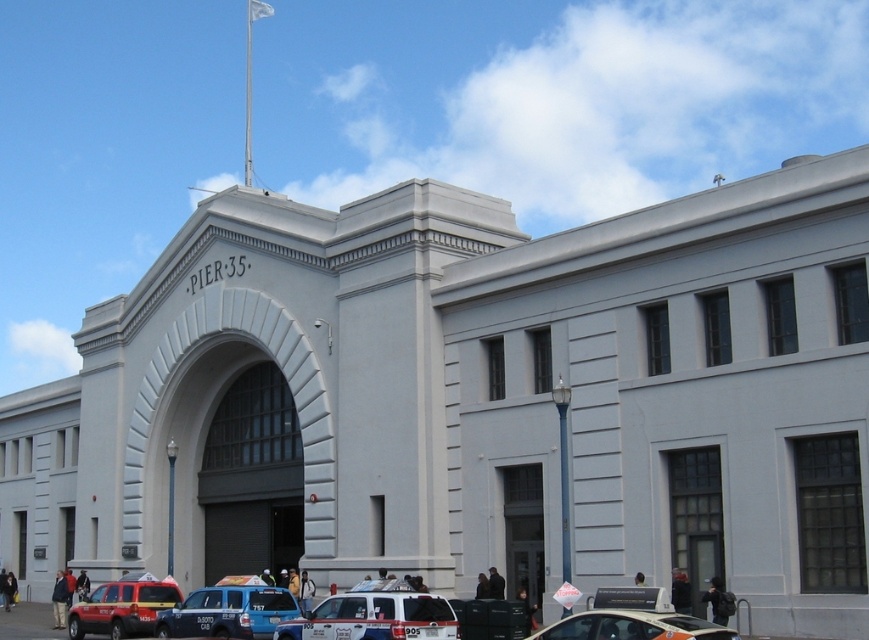
Is white glossy car at lower right bigger than matte red suv at lower left?

No.

Is point (647, 593) farther from camera compared to point (123, 636)?

That is False.

Identify the location of white glossy car at lower right. (632, 620).

Looking at this image, is white glossy van at lower center bigger than blue metallic van at lower center?

Incorrect, white glossy van at lower center is not larger than blue metallic van at lower center.

Can you confirm if white glossy van at lower center is positioned below blue metallic van at lower center?

Incorrect, white glossy van at lower center is not positioned below blue metallic van at lower center.

Locate an element on the screen. The height and width of the screenshot is (640, 869). white glossy van at lower center is located at coordinates (375, 614).

Between white glossy car at lower right and blue metallic van at lower center, which one is positioned lower?

blue metallic van at lower center is below.

Between white glossy car at lower right and blue metallic van at lower center, which one appears on the left side from the viewer's perspective?

blue metallic van at lower center is more to the left.

I want to click on white glossy car at lower right, so click(632, 620).